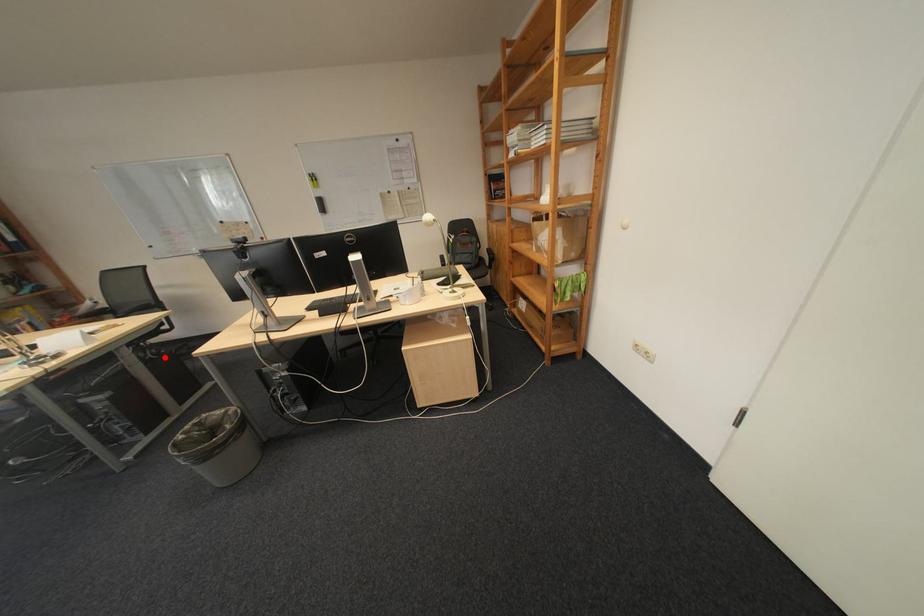
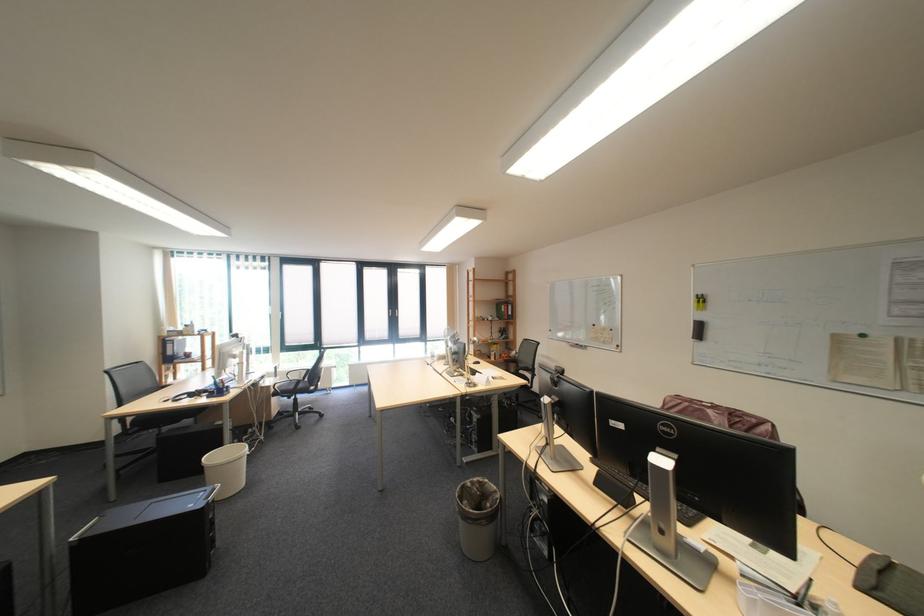
Question: I am providing you with two images of the same scene from different viewpoints. A red point is shown in image1. For the corresponding object point in image2, is it positioned nearer or farther from the camera?

Choices:
 (A) Nearer
 (B) Farther

Answer: (B)